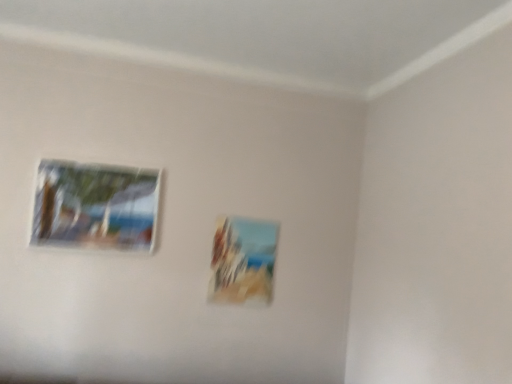
Question: From a real-world perspective, is matte glass picture frame at upper left, positioned as the 2th picture frame in right-to-left order, on top of matte wooden picture frame at center, the 1th picture frame positioned from the right?

Choices:
 (A) no
 (B) yes

Answer: (B)

Question: From the image's perspective, is matte glass picture frame at upper left, marked as the 1th picture frame in a left-to-right arrangement, under matte wooden picture frame at center, acting as the 2th picture frame starting from the front?

Choices:
 (A) no
 (B) yes

Answer: (A)

Question: Is matte glass picture frame at upper left, marked as the 1th picture frame in a front-to-back arrangement, smaller than matte wooden picture frame at center, the 1th picture frame positioned from the right?

Choices:
 (A) yes
 (B) no

Answer: (B)

Question: Is matte wooden picture frame at center, which appears as the 1th picture frame when viewed from the back, completely or partially inside matte glass picture frame at upper left, marked as the 1th picture frame in a left-to-right arrangement?

Choices:
 (A) yes
 (B) no

Answer: (B)

Question: From a real-world perspective, is matte glass picture frame at upper left, marked as the 1th picture frame in a front-to-back arrangement, positioned under matte wooden picture frame at center, the 1th picture frame positioned from the right, based on gravity?

Choices:
 (A) yes
 (B) no

Answer: (B)

Question: Is there a large distance between matte glass picture frame at upper left, marked as the 1th picture frame in a left-to-right arrangement, and matte wooden picture frame at center, which appears as the 1th picture frame when viewed from the back?

Choices:
 (A) no
 (B) yes

Answer: (A)

Question: Could matte glass picture frame at upper left, marked as the 1th picture frame in a front-to-back arrangement, be considered to be inside matte wooden picture frame at center, arranged as the 2th picture frame when viewed from the left?

Choices:
 (A) no
 (B) yes

Answer: (A)

Question: From the image's perspective, would you say matte wooden picture frame at center, the 1th picture frame positioned from the right, is shown under matte glass picture frame at upper left, marked as the 1th picture frame in a front-to-back arrangement?

Choices:
 (A) yes
 (B) no

Answer: (A)

Question: From a real-world perspective, is matte wooden picture frame at center, acting as the 2th picture frame starting from the front, under matte glass picture frame at upper left, marked as the second picture frame in a back-to-front arrangement?

Choices:
 (A) no
 (B) yes

Answer: (B)

Question: Can you confirm if matte wooden picture frame at center, arranged as the 2th picture frame when viewed from the left, is thinner than matte glass picture frame at upper left, marked as the 1th picture frame in a left-to-right arrangement?

Choices:
 (A) no
 (B) yes

Answer: (B)

Question: Is matte wooden picture frame at center, the 1th picture frame positioned from the right, positioned with its back to matte glass picture frame at upper left, marked as the second picture frame in a back-to-front arrangement?

Choices:
 (A) yes
 (B) no

Answer: (B)

Question: Can you confirm if matte wooden picture frame at center, which appears as the 1th picture frame when viewed from the back, is positioned to the left of matte glass picture frame at upper left, marked as the 1th picture frame in a front-to-back arrangement?

Choices:
 (A) no
 (B) yes

Answer: (A)

Question: Is point (229, 271) positioned closer to the camera than point (54, 185)?

Choices:
 (A) closer
 (B) farther

Answer: (B)